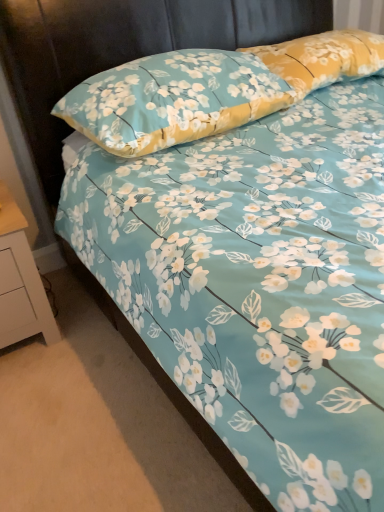
Question: Which is correct: yellow floral pillow at upper right, which is counted as the 2th pillow, starting from the left, is inside white painted wood nightstand at lower left, or outside of it?

Choices:
 (A) outside
 (B) inside

Answer: (A)

Question: Considering the positions of yellow floral pillow at upper right, which is the 1th pillow in right-to-left order, and white painted wood nightstand at lower left in the image, is yellow floral pillow at upper right, which is the 1th pillow in right-to-left order, bigger or smaller than white painted wood nightstand at lower left?

Choices:
 (A) small
 (B) big

Answer: (A)

Question: Which is nearer to the yellow floral pillow at upper right, which is counted as the 2th pillow, starting from the left?

Choices:
 (A) floral fabric pillow at upper center, the second pillow positioned from the right
 (B) white painted wood nightstand at lower left

Answer: (A)

Question: Which object is positioned closest to the floral fabric pillow at upper center, the first pillow from the left?

Choices:
 (A) yellow floral pillow at upper right, which is the 1th pillow in right-to-left order
 (B) white painted wood nightstand at lower left

Answer: (A)